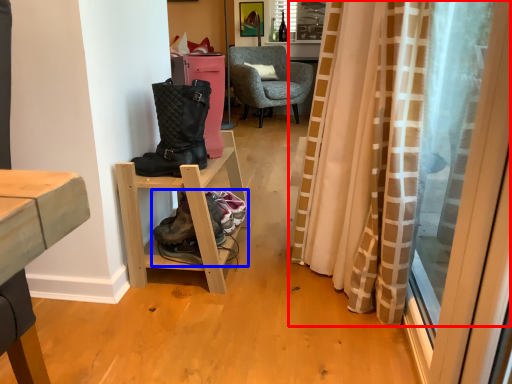
Question: Among these objects, which one is farthest to the camera, curtain (highlighted by a red box) or footwear (highlighted by a blue box)?

Choices:
 (A) curtain
 (B) footwear

Answer: (B)